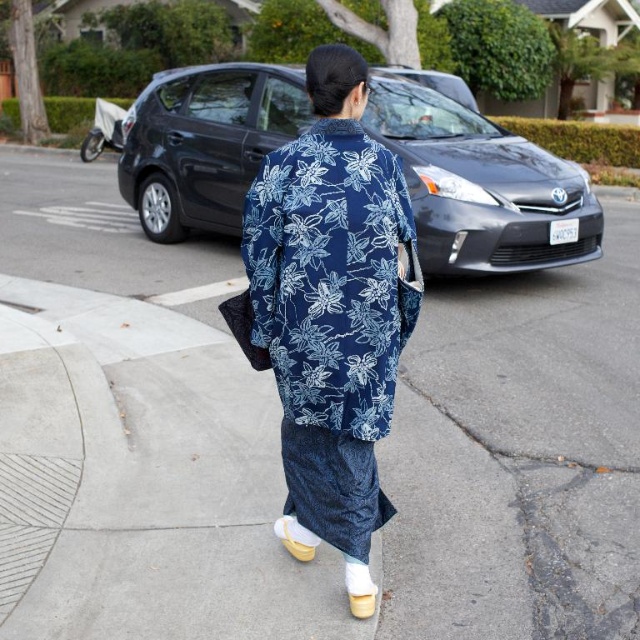
Question: Which point is farther to the camera?

Choices:
 (A) white suede sandal at lower center
 (B) blue floral kimono at center
 (C) white leather shoe at lower center

Answer: (A)

Question: Does blue fabric kimono at center come behind metallic gray sedan at center?

Choices:
 (A) yes
 (B) no

Answer: (B)

Question: Is blue fabric kimono at center to the right of blue floral kimono at center from the viewer's perspective?

Choices:
 (A) yes
 (B) no

Answer: (B)

Question: Does white suede sandal at lower center lie behind white leather shoe at lower center?

Choices:
 (A) no
 (B) yes

Answer: (B)

Question: Which point is closer to the camera taking this photo?

Choices:
 (A) (161, 410)
 (B) (227, 120)
 (C) (280, 536)
 (D) (292, 291)

Answer: (D)

Question: Which of the following is the closest to the observer?

Choices:
 (A) metallic gray sedan at center
 (B) blue floral kimono at center
 (C) white suede sandal at lower center

Answer: (B)